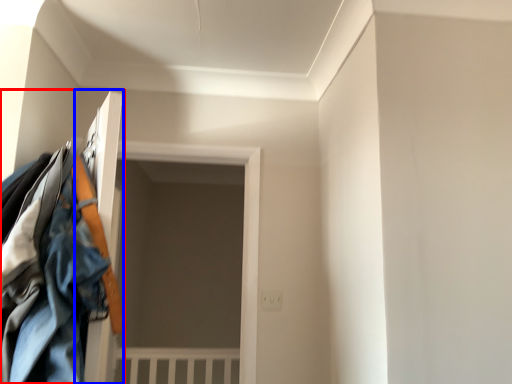
Question: Which object is closer to the camera taking this photo, closet (highlighted by a red box) or door (highlighted by a blue box)?

Choices:
 (A) closet
 (B) door

Answer: (A)